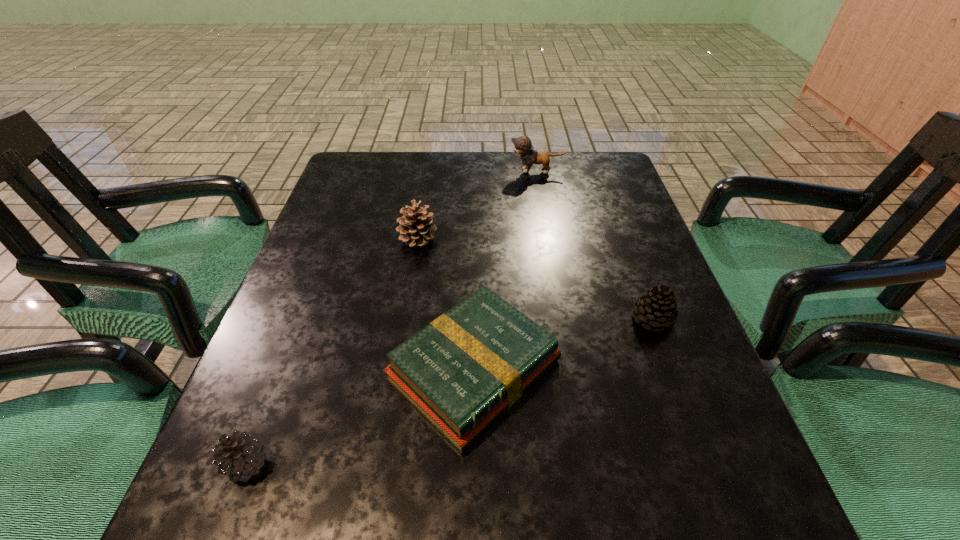
Where is `free space between the shortest object and the second farthest object`? Image resolution: width=960 pixels, height=540 pixels. free space between the shortest object and the second farthest object is located at coordinates (446, 304).

Where is `free space between the leftmost pinecone and the fourth nearest object`? free space between the leftmost pinecone and the fourth nearest object is located at coordinates (332, 352).

Where is `free space that is in between the farthest object and the shortest object`? free space that is in between the farthest object and the shortest object is located at coordinates (506, 271).

The image size is (960, 540). In order to click on vacant space in between the hardback book and the second farthest pinecone in this screenshot , I will do `click(564, 345)`.

Where is `empty location between the farthest object and the leftmost object`? empty location between the farthest object and the leftmost object is located at coordinates point(392,318).

Find the location of a particular element. The image size is (960, 540). vacant area that lies between the second pinecone from left to right and the rightmost object is located at coordinates (535, 279).

Locate an element on the screen. free space between the shortest object and the farthest object is located at coordinates coord(506,271).

Identify which object is the fourth closest to the rightmost object. Please provide its 2D coordinates. Your answer should be formatted as a tuple, i.e. [(x, y)], where the tuple contains the x and y coordinates of a point satisfying the conditions above.

[(242, 456)]

In order to click on object that is the third closest to the farthest object in this screenshot , I will do `click(461, 372)`.

Find the location of a particular element. The width and height of the screenshot is (960, 540). the closest pinecone to the fourth nearest object is located at coordinates (656, 308).